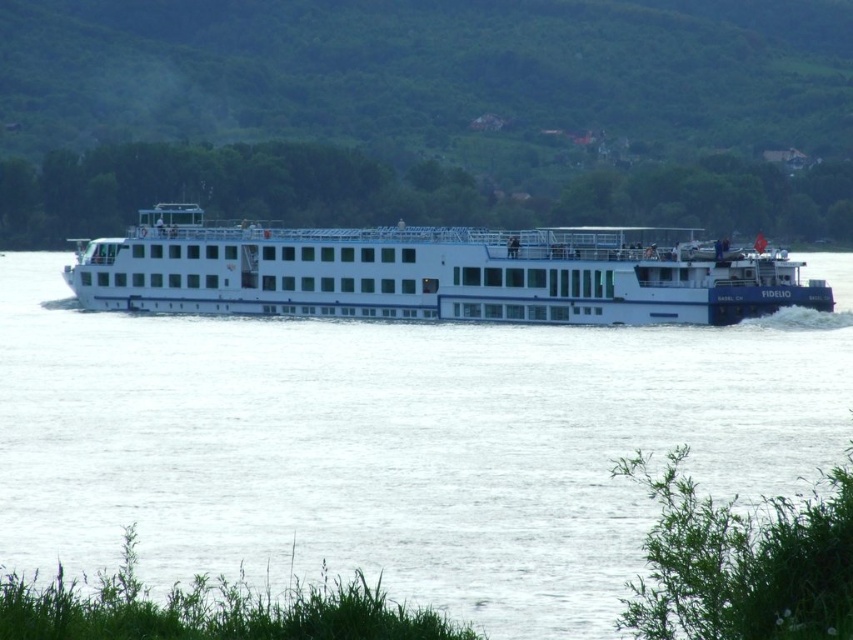
Question: Does white smooth water at center have a smaller size compared to white glossy cruise ship at center?

Choices:
 (A) yes
 (B) no

Answer: (B)

Question: Does white smooth water at center appear on the left side of white glossy cruise ship at center?

Choices:
 (A) yes
 (B) no

Answer: (A)

Question: Which point is farther to the camera?

Choices:
 (A) (173, 301)
 (B) (786, 417)

Answer: (A)

Question: Which object is closer to the camera taking this photo?

Choices:
 (A) white glossy cruise ship at center
 (B) white smooth water at center

Answer: (B)

Question: Does white smooth water at center have a greater width compared to white glossy cruise ship at center?

Choices:
 (A) yes
 (B) no

Answer: (A)